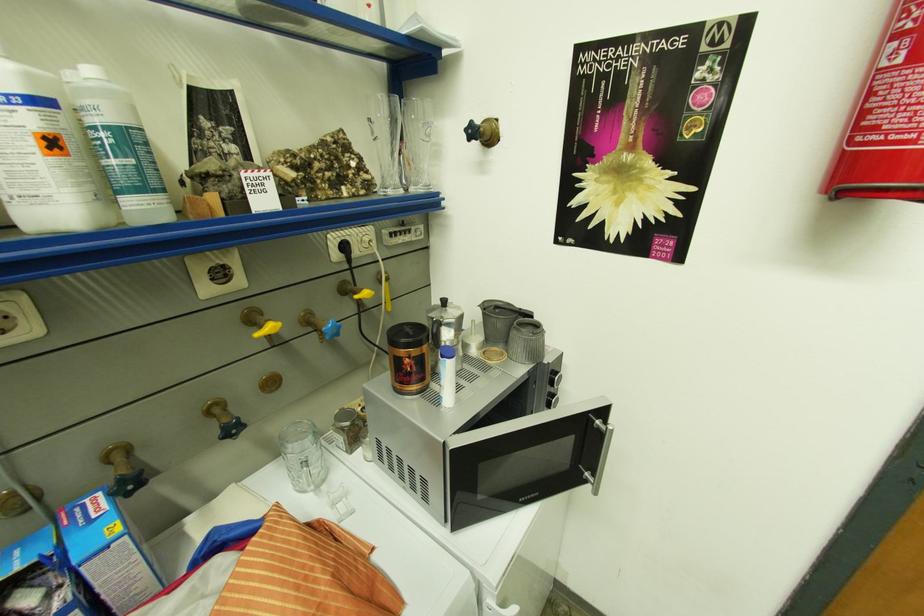
Where is `glass mug handle`? glass mug handle is located at coordinates (302, 456).